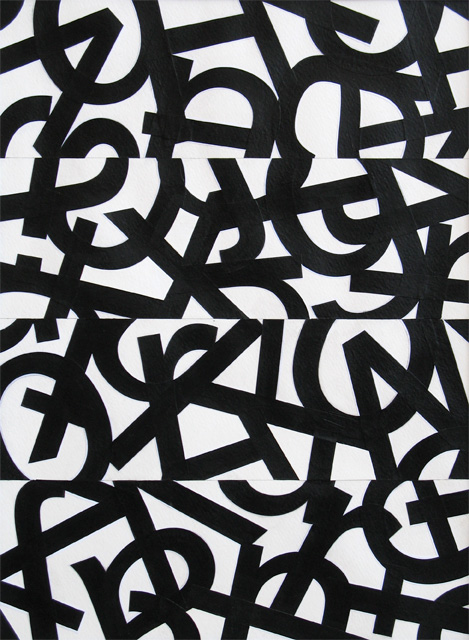
Identify the location of left side of art. (1, 314).